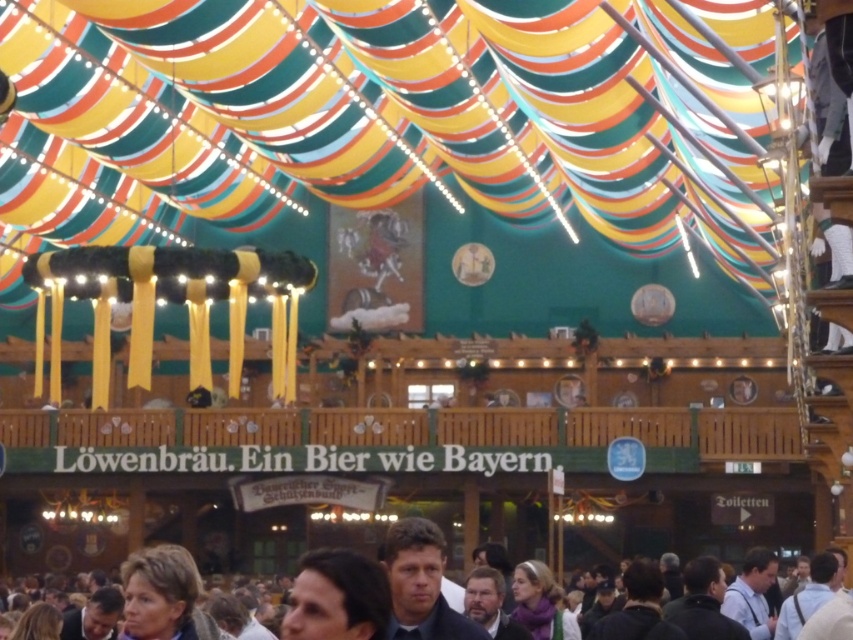
You are a photographer at the event and want to take a photo of both the light blue shirt at lower right and the light brown leather jacket at lower right. However, you need to ensure that neither is blocking the other in the photo. Where should you position yourself relative to the subjects to achieve this?

You should position yourself so that you can see the light blue shirt at lower right in front of the light brown leather jacket at lower right. Since the light brown leather jacket at lower right is behind the light blue shirt at lower right, moving to a position where the light blue shirt is between you and the jacket will ensure neither blocks the other.

You are at a beer festival and see two shirts hanging on a rack. The blue denim shirt at center and the light blue shirt at lower right. Which one is taller?

The blue denim shirt at center is much taller than the light blue shirt at lower right.

You are a photographer at the festival and need to capture both the blue denim shirt at center and the smooth black suit at lower left in a single shot. Can you position yourself so that both are fully visible without any obstruction?

The blue denim shirt at center is in front of the smooth black suit at lower left, so if you position yourself behind the smooth black suit at lower left, you can capture both in the shot with the blue denim shirt at center visible in front and the smooth black suit at lower left behind it.